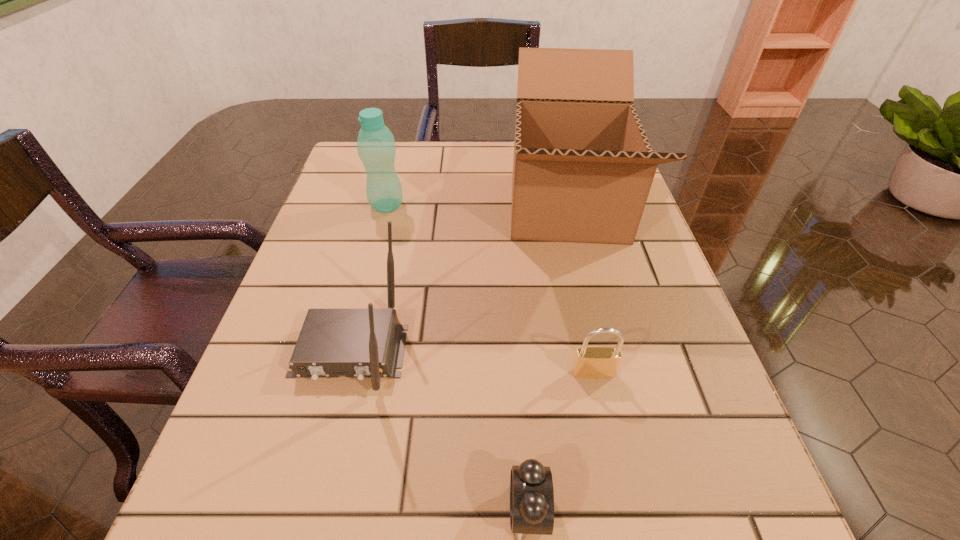
At what (x,y) coordinates should I click in order to perform the action: click on router that is positioned at the left edge. Please return your answer as a coordinate pair (x, y). Looking at the image, I should click on (360, 343).

Locate an element on the screen. The height and width of the screenshot is (540, 960). box at the right edge is located at coordinates (583, 167).

What are the coordinates of `padlock at the right edge` in the screenshot? It's located at (593, 362).

Locate an element on the screen. object located at the far right corner is located at coordinates (583, 167).

This screenshot has width=960, height=540. I want to click on free space at the near edge, so click(481, 492).

I want to click on vacant space at the left edge, so click(268, 362).

At what (x,y) coordinates should I click in order to perform the action: click on free region at the right edge of the desktop. Please return your answer as a coordinate pair (x, y). The width and height of the screenshot is (960, 540). Looking at the image, I should click on (643, 235).

Find the location of a particular element. The height and width of the screenshot is (540, 960). free space at the far left corner of the desktop is located at coordinates (343, 164).

Locate an element on the screen. This screenshot has height=540, width=960. free area in between the box and the padlock is located at coordinates (580, 290).

Locate an element on the screen. This screenshot has height=540, width=960. free space between the bottle and the padlock is located at coordinates (491, 289).